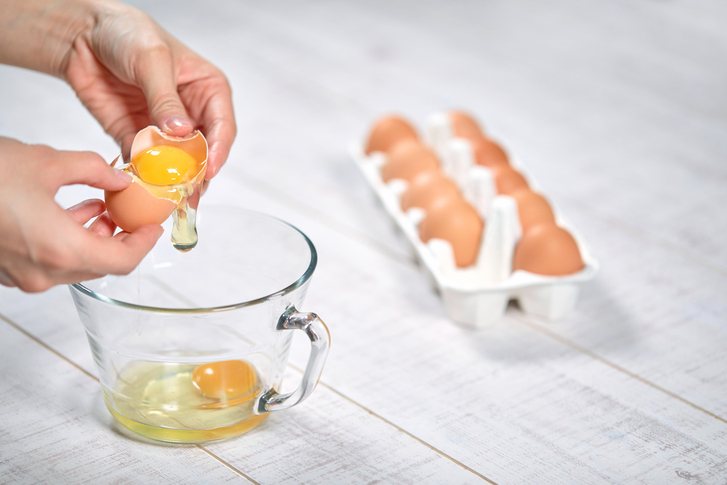
Locate an element on the screen. The height and width of the screenshot is (485, 727). wooded tabletop is located at coordinates (651, 210).